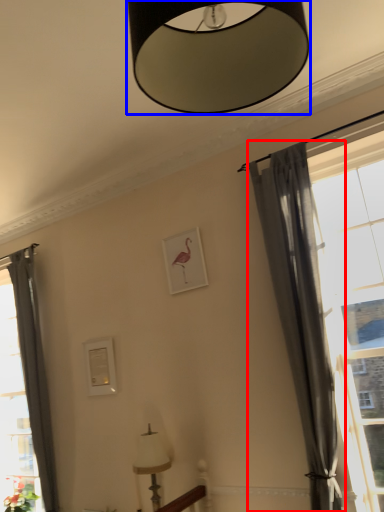
Question: Which point is closer to the camera, curtain (highlighted by a red box) or lamp (highlighted by a blue box)?

Choices:
 (A) curtain
 (B) lamp

Answer: (B)